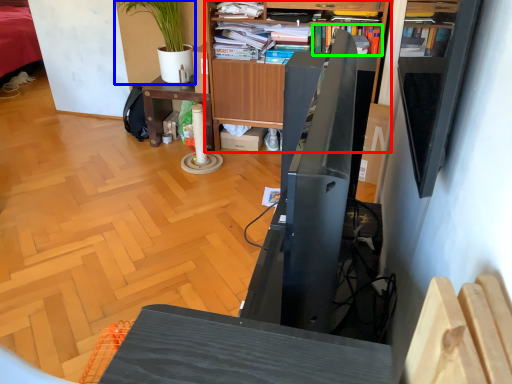
Question: Which object is the closest to the bookcase (highlighted by a red box)? Choose among these: houseplant (highlighted by a blue box) or book (highlighted by a green box).

Choices:
 (A) houseplant
 (B) book

Answer: (B)